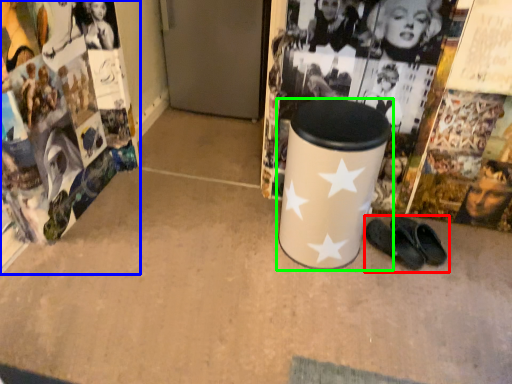
Question: Considering the real-world distances, which object is farthest from footwear (highlighted by a red box)? magazine (highlighted by a blue box) or waste container (highlighted by a green box)?

Choices:
 (A) magazine
 (B) waste container

Answer: (A)